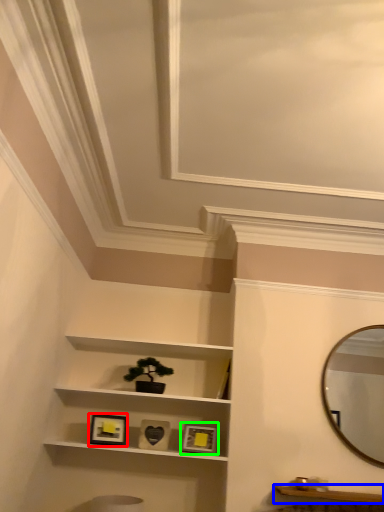
Question: Based on their relative distances, which object is farther from picture frame (highlighted by a red box)? Choose from cabinetry (highlighted by a blue box) and picture frame (highlighted by a green box).

Choices:
 (A) cabinetry
 (B) picture frame

Answer: (A)